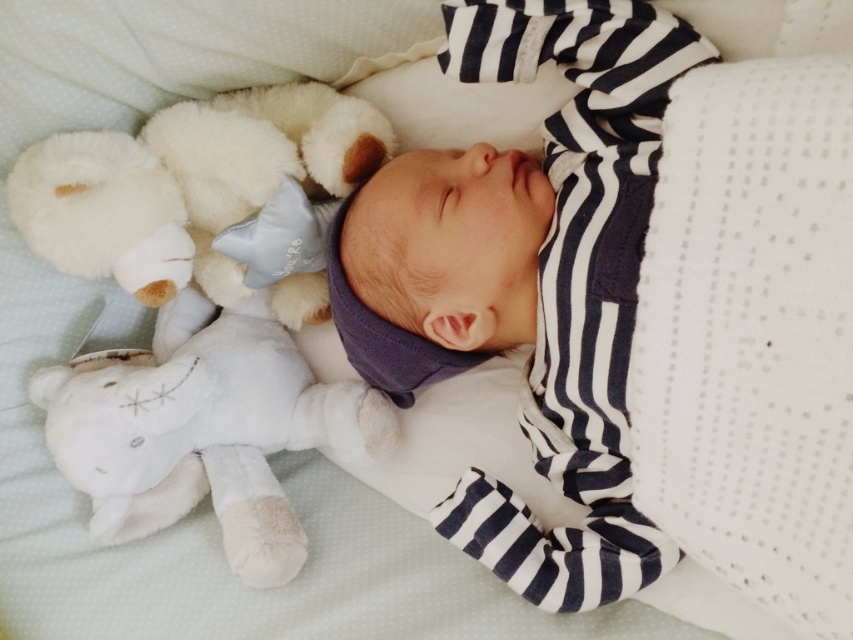
Which is more to the right, white plush bear at upper left or white plush teddy bear at upper left?

From the viewer's perspective, white plush bear at upper left appears more on the right side.

This screenshot has height=640, width=853. What do you see at coordinates (204, 429) in the screenshot? I see `white plush bear at upper left` at bounding box center [204, 429].

Between point (207, 364) and point (115, 257), which one is positioned behind?

Point (207, 364)

Find the location of a particular element. white plush bear at upper left is located at coordinates (204, 429).